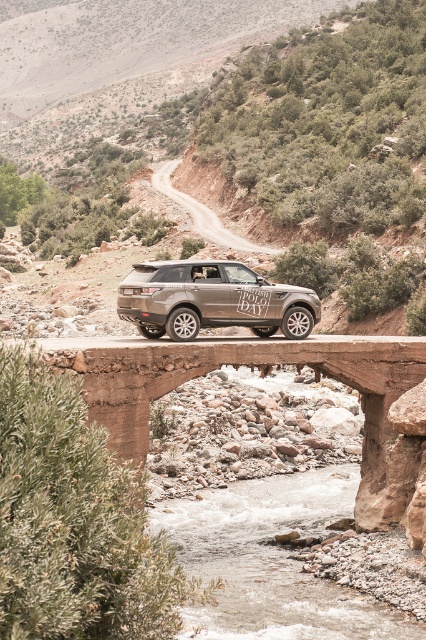
Question: Estimate the real-world distances between objects in this image. Which object is closer to the clear water at center?

Choices:
 (A) matte metallic suv at center
 (B) rustic stone bridge at center
 (C) smooth gravel road at center

Answer: (B)

Question: Does clear water at center appear on the right side of matte metallic suv at center?

Choices:
 (A) no
 (B) yes

Answer: (B)

Question: Which object is the closest to the clear water at center?

Choices:
 (A) smooth gravel road at center
 (B) rustic stone bridge at center

Answer: (B)

Question: Can you confirm if clear water at center is wider than matte metallic suv at center?

Choices:
 (A) no
 (B) yes

Answer: (B)

Question: Which point is farther to the camera?

Choices:
 (A) (339, 358)
 (B) (210, 608)
 (C) (164, 323)
 (D) (242, 248)

Answer: (D)

Question: Can you confirm if matte metallic suv at center is positioned to the left of smooth gravel road at center?

Choices:
 (A) no
 (B) yes

Answer: (A)